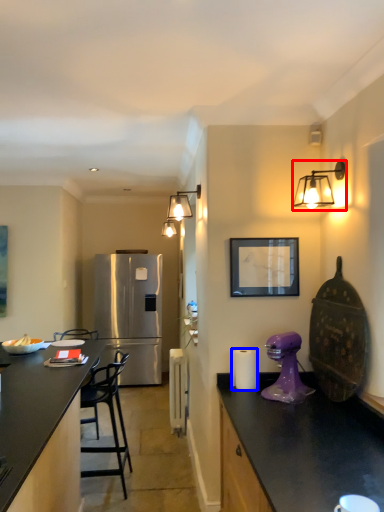
Question: Which object appears farthest to the camera in this image, light fixture (highlighted by a red box) or paper towel (highlighted by a blue box)?

Choices:
 (A) light fixture
 (B) paper towel

Answer: (B)